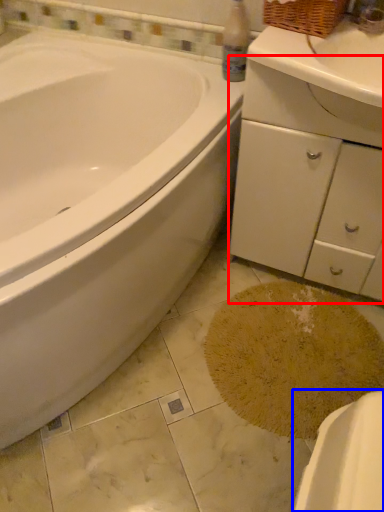
Question: Which point is further to the camera, dresser (highlighted by a red box) or porcelain (highlighted by a blue box)?

Choices:
 (A) dresser
 (B) porcelain

Answer: (A)